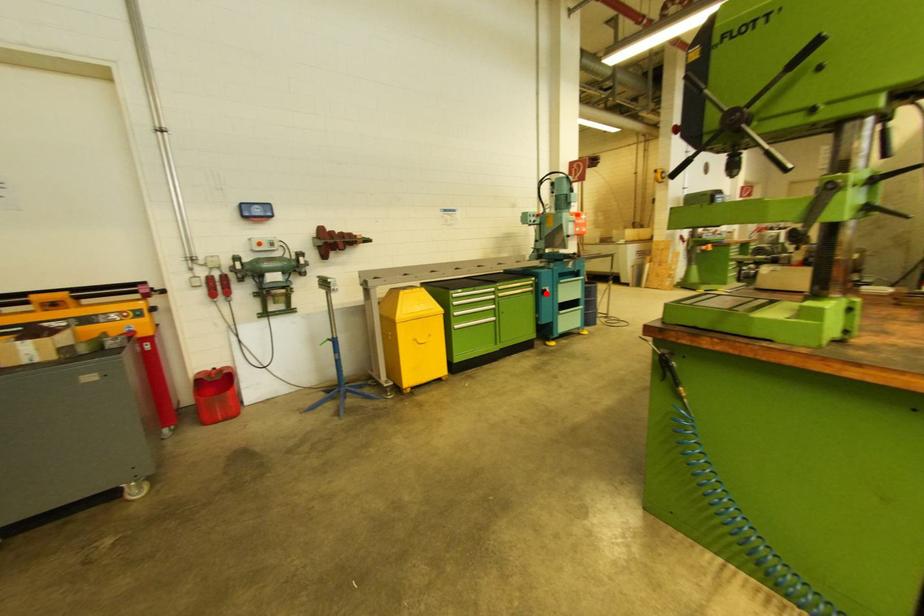
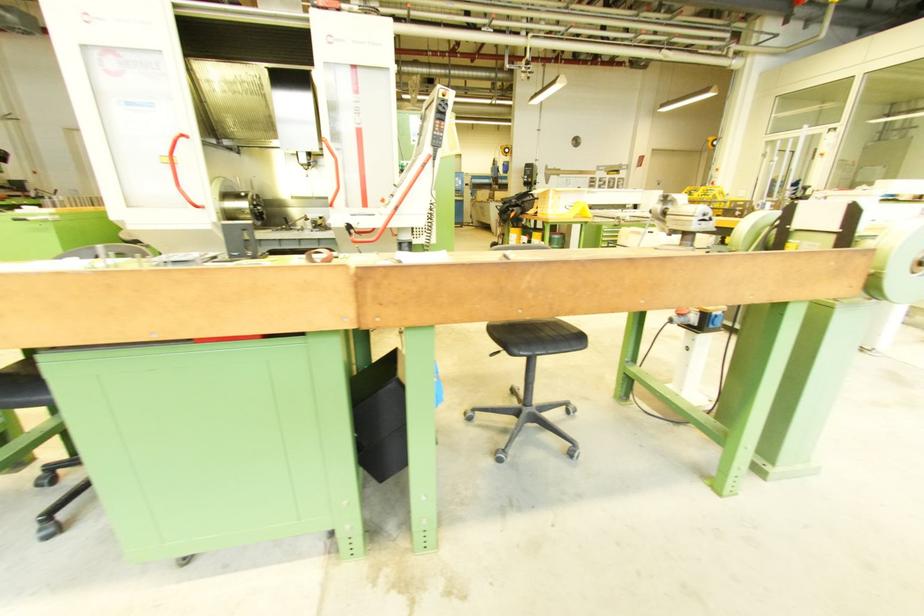
Question: I am providing you with two images of the same scene from different viewpoints. A red point is marked on the first image. Can you still see the location of the red point in image 2?

Choices:
 (A) Yes
 (B) No

Answer: (B)